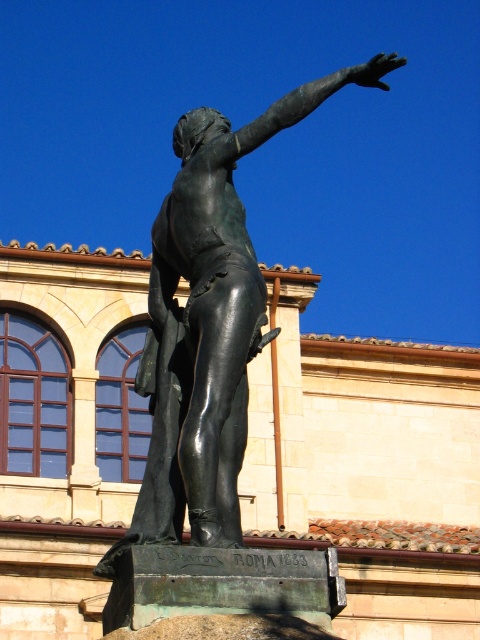
Question: Which object is closer to the camera taking this photo?

Choices:
 (A) bronze arm at upper right
 (B) shiny bronze statue at center

Answer: (B)

Question: Does shiny bronze statue at center have a lesser width compared to bronze arm at upper right?

Choices:
 (A) no
 (B) yes

Answer: (B)

Question: Which point appears closest to the camera in this image?

Choices:
 (A) (157, 284)
 (B) (314, 104)

Answer: (B)

Question: Can you confirm if shiny bronze statue at center is positioned to the right of bronze arm at upper right?

Choices:
 (A) no
 (B) yes

Answer: (A)

Question: Observing the image, what is the correct spatial positioning of shiny bronze statue at center in reference to bronze arm at upper right?

Choices:
 (A) below
 (B) above

Answer: (A)